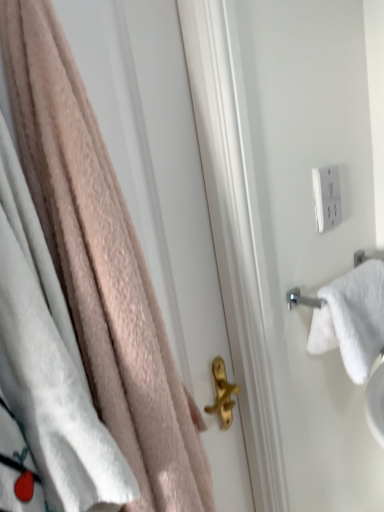
Question: Is point (372, 358) closer or farther from the camera than point (339, 212)?

Choices:
 (A) closer
 (B) farther

Answer: (A)

Question: In terms of width, does white cotton towel at right, acting as the 1th towel starting from the back, look wider or thinner when compared to white plastic outlet at upper right?

Choices:
 (A) wide
 (B) thin

Answer: (A)

Question: Which object is positioned closest to the white plastic outlet at upper right?

Choices:
 (A) white cotton towel at right, positioned as the 2th towel in left-to-right order
 (B) soft pink towel at left, positioned as the 1th towel in front-to-back order

Answer: (A)

Question: Considering the real-world distances, which object is closest to the white plastic outlet at upper right?

Choices:
 (A) white cotton towel at right, which is counted as the second towel, starting from the front
 (B) soft pink towel at left, marked as the 2th towel in a right-to-left arrangement

Answer: (A)